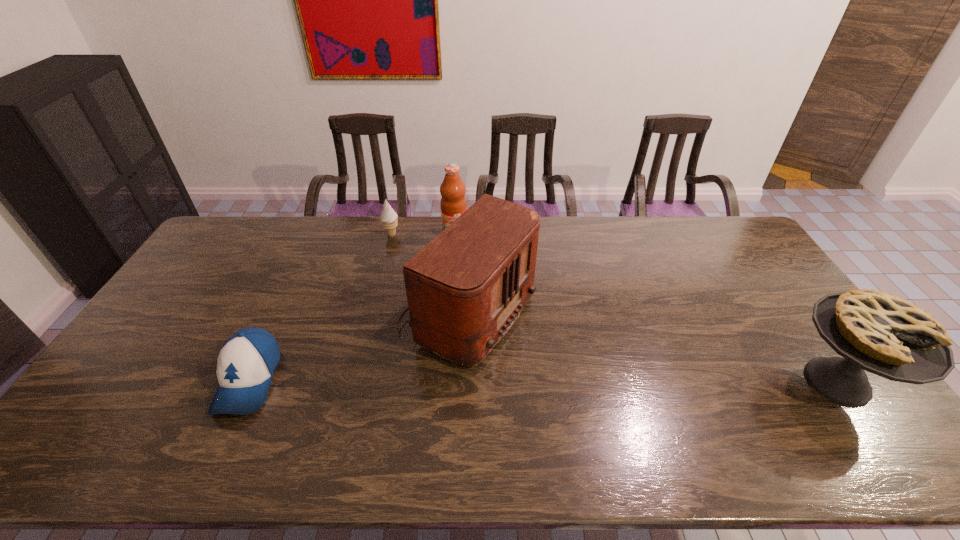
Image resolution: width=960 pixels, height=540 pixels. Find the location of `object that is at the right edge`. object that is at the right edge is located at coordinates (875, 331).

This screenshot has height=540, width=960. I want to click on object that is at the near right corner, so click(x=875, y=331).

Find the location of a particular element. This screenshot has width=960, height=540. blank space at the far edge of the desktop is located at coordinates (620, 227).

The height and width of the screenshot is (540, 960). Find the location of `vacant region at the near edge of the desktop`. vacant region at the near edge of the desktop is located at coordinates (530, 411).

You are a GUI agent. You are given a task and a screenshot of the screen. Output one action in this format:
    pyautogui.click(x=<x>, y=<y>)
    Task: Click on the blank area at the left edge
    
    Given the screenshot: What is the action you would take?
    pyautogui.click(x=234, y=258)

In order to click on empty space between the radio receiver and the rightmost object in this screenshot , I will do `click(649, 348)`.

Where is `vacant area that lies between the fruit juice and the pie`? The width and height of the screenshot is (960, 540). vacant area that lies between the fruit juice and the pie is located at coordinates (646, 308).

Image resolution: width=960 pixels, height=540 pixels. Find the location of `vacant area that lies between the second object from left to right and the rightmost object`. vacant area that lies between the second object from left to right and the rightmost object is located at coordinates (614, 308).

At what (x,y) coordinates should I click in order to perform the action: click on free space between the fruit juice and the icecream. Please return your answer as a coordinate pair (x, y). Image resolution: width=960 pixels, height=540 pixels. Looking at the image, I should click on (423, 234).

At what (x,y) coordinates should I click in order to perform the action: click on vacant point located between the second shortest object and the rightmost object. Please return your answer as a coordinate pair (x, y). Looking at the image, I should click on tap(614, 308).